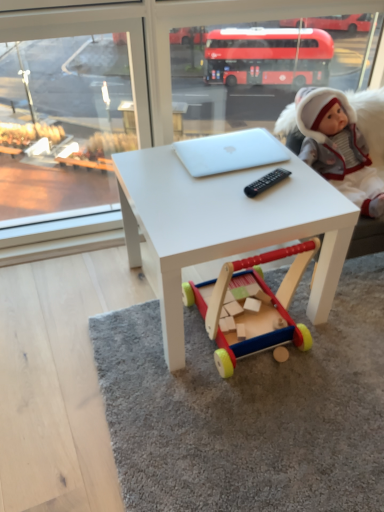
The image size is (384, 512). What are the coordinates of `vacant space in white matte laptop at center (from a real-world perspective)` in the screenshot? It's located at (230, 150).